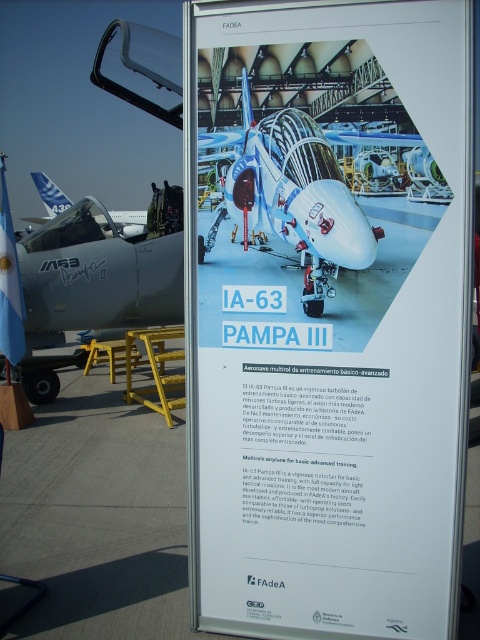
Question: Observing the image, what is the correct spatial positioning of white glossy ia-63 pampa iii at center in reference to matte blue airplane at center?

Choices:
 (A) left
 (B) right

Answer: (B)

Question: Which point is closer to the camera?

Choices:
 (A) matte gray aircraft at left
 (B) matte white airplane at center

Answer: (A)

Question: Is white glossy ia-63 pampa iii at center thinner than matte blue airplane at center?

Choices:
 (A) no
 (B) yes

Answer: (A)

Question: Which object is positioned closest to the matte blue airplane at center?

Choices:
 (A) matte gray aircraft at left
 (B) white glossy ia-63 pampa iii at center
 (C) matte white airplane at center

Answer: (B)

Question: Does white glossy ia-63 pampa iii at center appear under matte blue airplane at center?

Choices:
 (A) yes
 (B) no

Answer: (A)

Question: Which is nearer to the matte white airplane at center?

Choices:
 (A) matte gray aircraft at left
 (B) white glossy ia-63 pampa iii at center

Answer: (A)